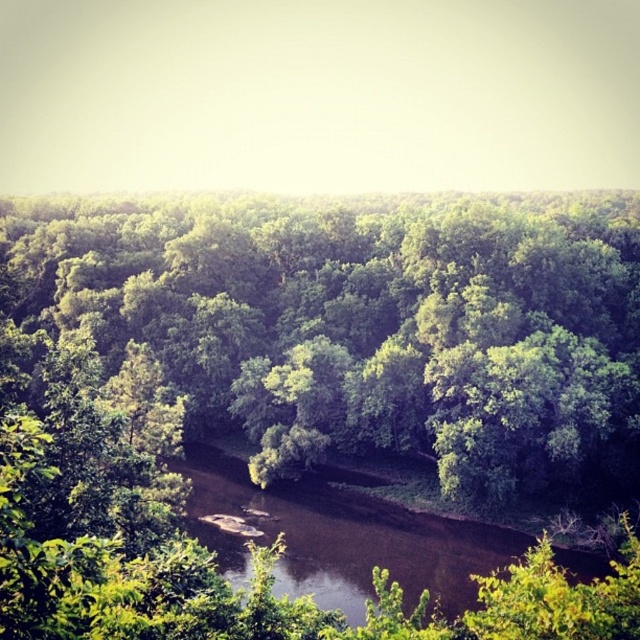
Question: Can you confirm if green leafy forest at center is bigger than brown smooth river at center?

Choices:
 (A) yes
 (B) no

Answer: (A)

Question: Can you confirm if green leafy forest at center is positioned above brown smooth river at center?

Choices:
 (A) yes
 (B) no

Answer: (A)

Question: Is green leafy forest at center smaller than brown smooth river at center?

Choices:
 (A) no
 (B) yes

Answer: (A)

Question: Which object is farther from the camera taking this photo?

Choices:
 (A) green leafy forest at center
 (B) brown smooth river at center

Answer: (B)

Question: Which of the following is the closest to the observer?

Choices:
 (A) (282, 500)
 (B) (129, 637)

Answer: (B)